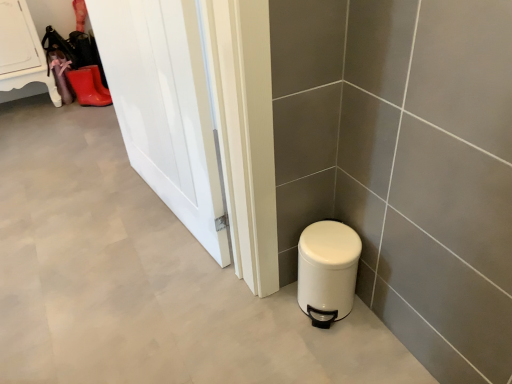
Locate an element on the screen. vacant area that is in front of white matte trash can at lower right is located at coordinates (338, 351).